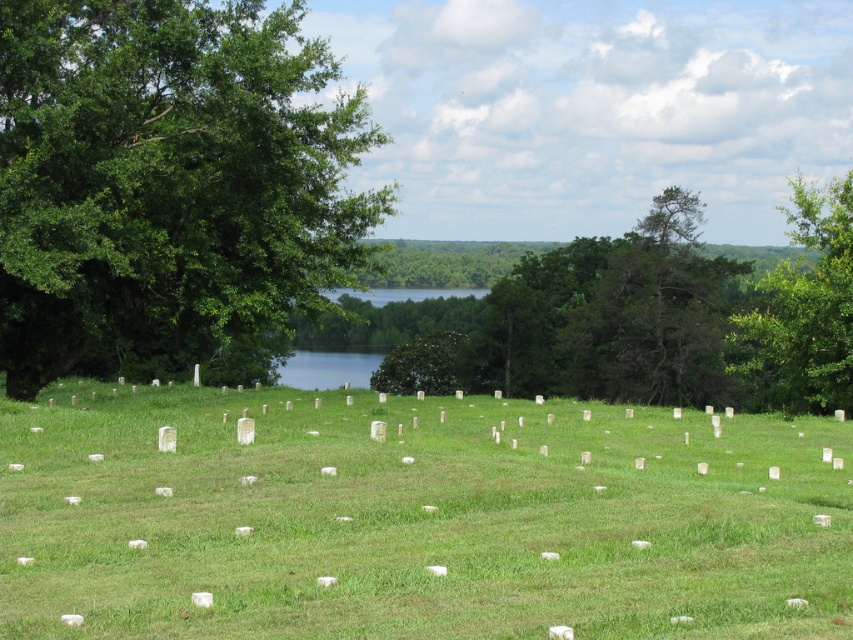
Locate an element on the screen. This screenshot has height=640, width=853. green grass at center is located at coordinates (415, 518).

Is point (434, 625) closer to viewer compared to point (167, 140)?

Yes, point (434, 625) is closer to viewer.

Identify the location of green grass at center. (415, 518).

Who is lower down, green leafy tree at left or green leafy tree at upper right?

green leafy tree at upper right

The height and width of the screenshot is (640, 853). I want to click on green leafy tree at left, so click(x=167, y=173).

Identify the location of green leafy tree at left. This screenshot has height=640, width=853. (167, 173).

Looking at this image, does green grass at center have a lesser width compared to green leafy tree at upper right?

Yes.

Can you confirm if green grass at center is positioned to the left of green leafy tree at upper right?

Yes, green grass at center is to the left of green leafy tree at upper right.

Find the location of a particular element. Image resolution: width=853 pixels, height=640 pixels. green grass at center is located at coordinates point(415,518).

You are a GUI agent. You are given a task and a screenshot of the screen. Output one action in this format:
    pyautogui.click(x=<x>, y=<y>)
    Task: Click on the green grass at center
    
    Given the screenshot: What is the action you would take?
    pyautogui.click(x=415, y=518)